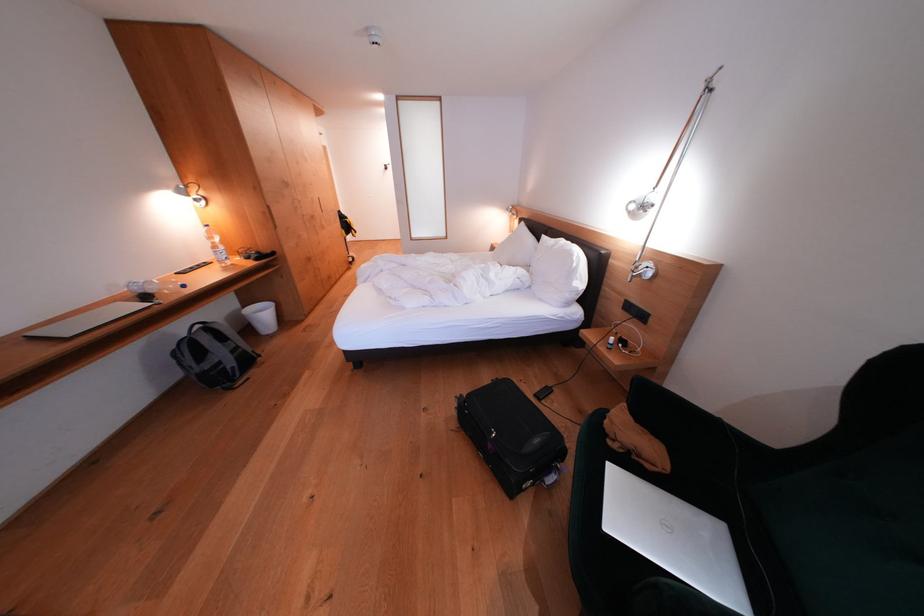
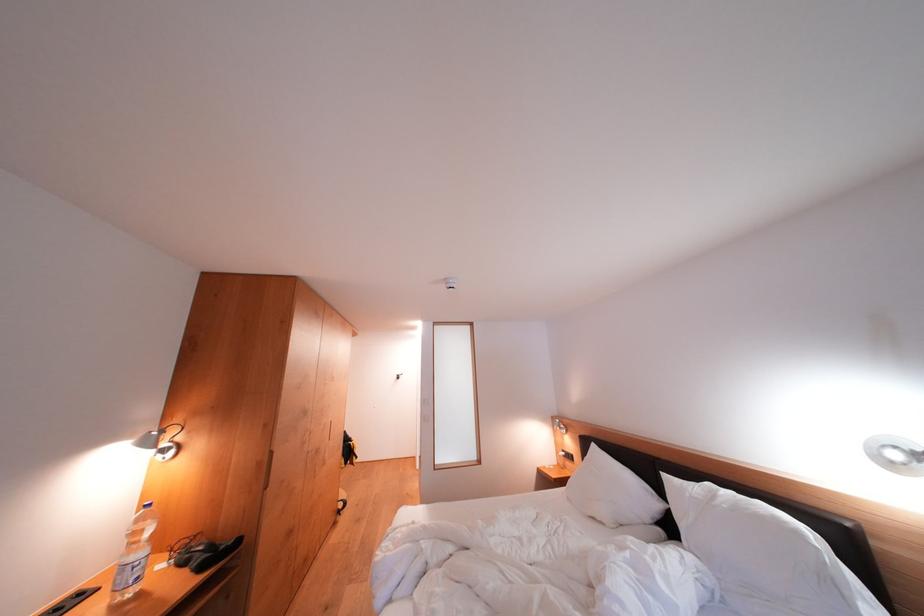
Where in the second image is the point corresponding to point (254, 262) from the first image?

(190, 567)